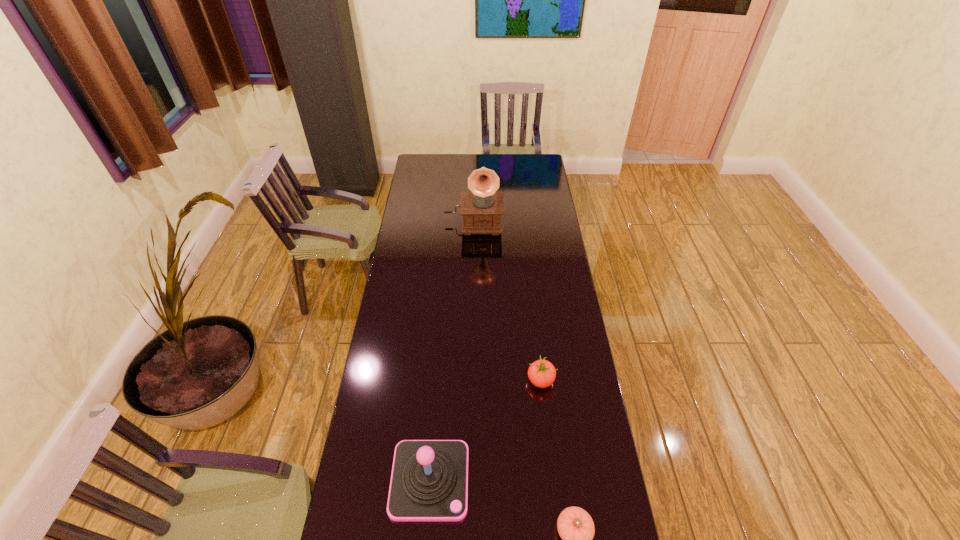
Find the location of a particular element. Image resolution: width=960 pixels, height=540 pixels. free space at the right edge is located at coordinates (560, 363).

This screenshot has width=960, height=540. I want to click on free spot at the far left corner of the desktop, so click(429, 154).

Where is `vacant space at the far right corner of the desktop`? The image size is (960, 540). vacant space at the far right corner of the desktop is located at coordinates (528, 167).

This screenshot has height=540, width=960. In order to click on free space between the joystick and the second shortest object in this screenshot , I will do `click(486, 430)`.

The image size is (960, 540). I want to click on vacant space in between the taller tomato and the tallest object, so coord(507,301).

This screenshot has width=960, height=540. Identify the location of free point between the third nearest object and the joystick. (486, 430).

Find the location of a particular element. free space between the third nearest object and the joystick is located at coordinates (486, 430).

You are a GUI agent. You are given a task and a screenshot of the screen. Output one action in this format:
    pyautogui.click(x=<x>, y=<y>)
    Task: Click on the free space between the tallest object and the farther tomato
    The height and width of the screenshot is (540, 960).
    Given the screenshot: What is the action you would take?
    pyautogui.click(x=507, y=301)

Identify which object is the third closest to the farthest object. Please provide its 2D coordinates. Your answer should be formatted as a tuple, i.e. [(x, y)], where the tuple contains the x and y coordinates of a point satisfying the conditions above.

[(575, 526)]

Locate which object is the second closest to the joystick. Please provide its 2D coordinates. Your answer should be formatted as a tuple, i.e. [(x, y)], where the tuple contains the x and y coordinates of a point satisfying the conditions above.

[(541, 373)]